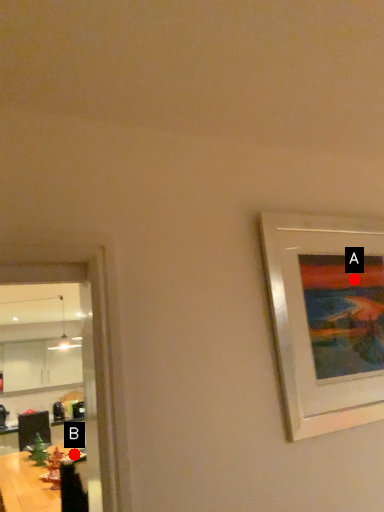
Question: Two points are circled on the image, labeled by A and B beside each circle. Which point is further to the camera?

Choices:
 (A) A is further
 (B) B is further

Answer: (B)